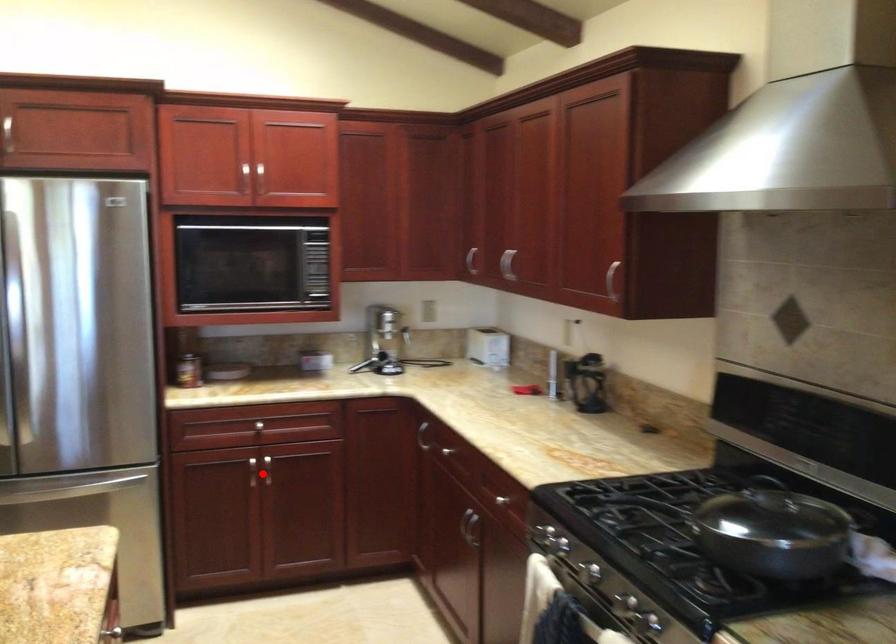
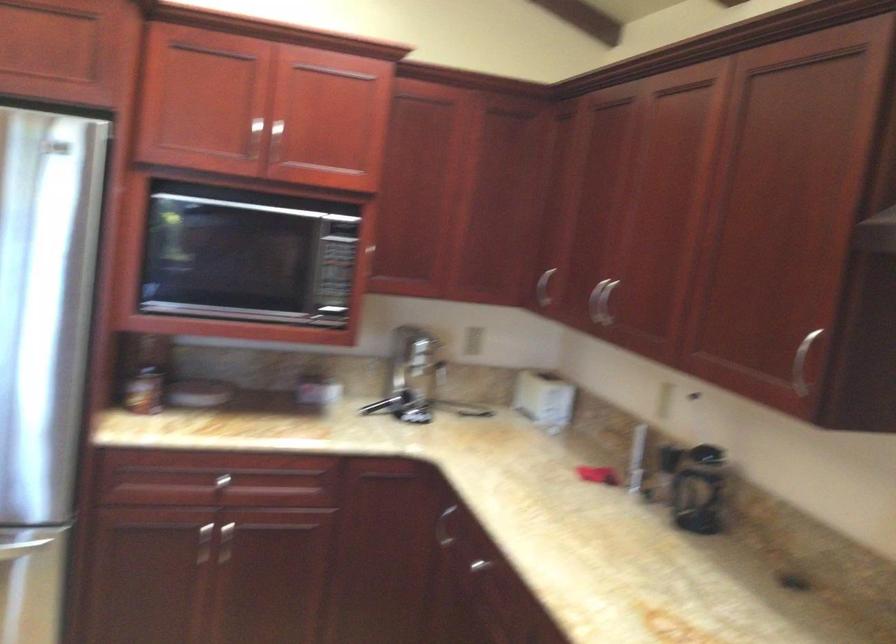
Question: I am providing you with two images of the same scene from different viewpoints. In image1, a red point is highlighted. Considering the same 3D point in image2, which of the following is correct?

Choices:
 (A) It is closer
 (B) It is farther

Answer: (A)